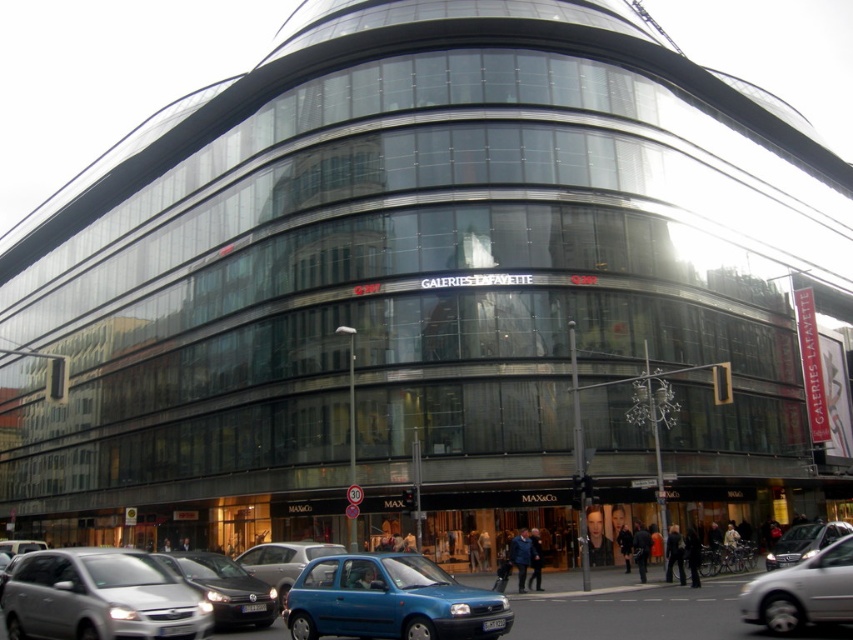
Question: In this image, where is matte blue hatchback at lower center located relative to silver metallic sedan at center?

Choices:
 (A) below
 (B) above

Answer: (B)

Question: Among these objects, which one is farthest from the camera?

Choices:
 (A) matte blue hatchback at center
 (B) blue metallic hatchback at center

Answer: (A)

Question: Can you confirm if silver metallic car at lower right is bigger than matte blue hatchback at center?

Choices:
 (A) no
 (B) yes

Answer: (A)

Question: Which object appears farthest from the camera in this image?

Choices:
 (A) matte blue hatchback at center
 (B) silver metallic car at lower right
 (C) silver metallic sedan at center

Answer: (C)

Question: Is silver metallic car at lower left to the right of silver metallic sedan at center from the viewer's perspective?

Choices:
 (A) yes
 (B) no

Answer: (B)

Question: Which point is farther to the camera?

Choices:
 (A) matte blue hatchback at center
 (B) silver metallic sedan at center
 (C) matte blue hatchback at lower center
 (D) silver metallic car at lower right

Answer: (B)